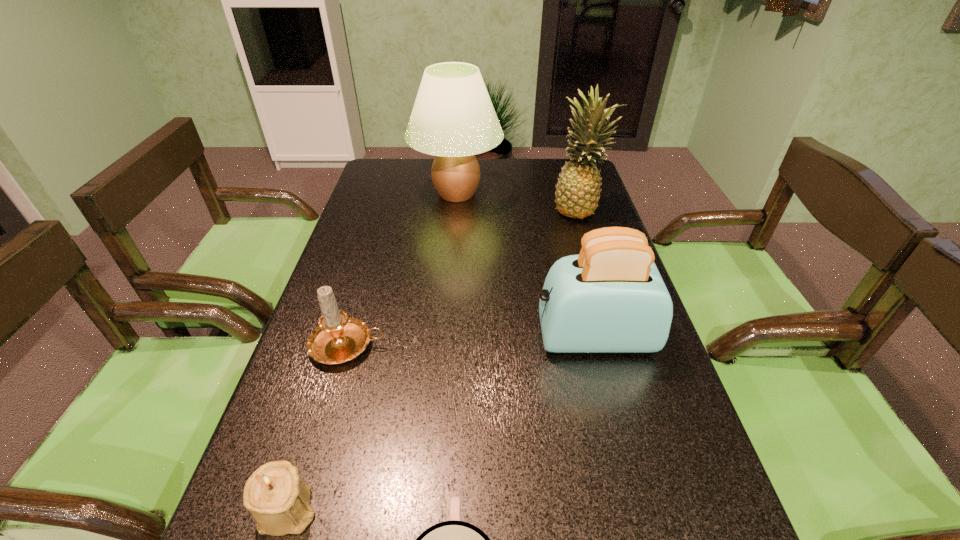
This screenshot has width=960, height=540. I want to click on free space between the toaster and the third shortest object, so click(x=471, y=341).

Locate an element on the screen. The image size is (960, 540). free spot between the candle_holder and the pineapple is located at coordinates (434, 359).

The width and height of the screenshot is (960, 540). Find the location of `unoccupied position between the candle_holder and the lampshade`. unoccupied position between the candle_holder and the lampshade is located at coordinates (372, 351).

Where is `vacant area that lies between the candle_holder and the candle`? vacant area that lies between the candle_holder and the candle is located at coordinates (318, 427).

At what (x,y) coordinates should I click in order to perform the action: click on object that can be found as the fifth closest to the candle. Please return your answer as a coordinate pair (x, y). Looking at the image, I should click on (577, 192).

Identify the location of object that stands as the fourth closest to the pineapple. (454, 539).

Image resolution: width=960 pixels, height=540 pixels. I want to click on free space that satisfies the following two spatial constraints: 1. on the shade of the lampshade; 2. on the right side of the pineapple, so click(x=455, y=210).

The width and height of the screenshot is (960, 540). Identify the location of vacant region that satisfies the following two spatial constraints: 1. on the shade of the lampshade; 2. on the left side of the pineapple. (455, 210).